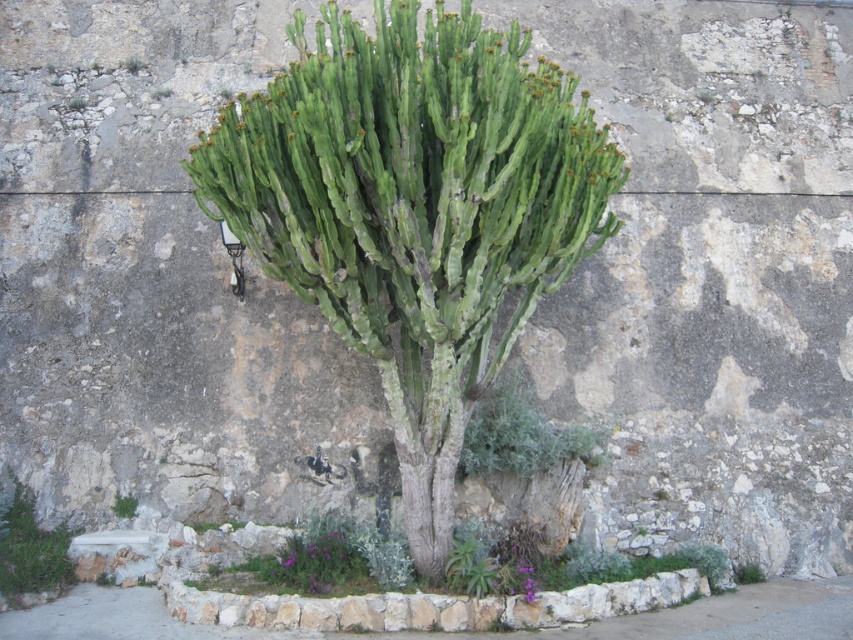
Which is in front, point (367, 252) or point (126, 502)?

Point (367, 252)

Does green woody at center have a lesser width compared to green succulent at lower left?

Yes.

Consider the image. Measure the distance between point (556,88) and camera.

Point (556,88) is 13.93 meters away from camera.

The height and width of the screenshot is (640, 853). In order to click on green woody at center in this screenshot , I will do `click(415, 209)`.

Describe the element at coordinates (28, 548) in the screenshot. I see `purple matte plant at lower left` at that location.

Does purple matte plant at lower left appear on the left side of green succulent at lower left?

Correct, you'll find purple matte plant at lower left to the left of green succulent at lower left.

Between point (18, 584) and point (120, 513), which one is positioned behind?

The point (120, 513) is more distant.

Find the location of a particular element. Image resolution: width=853 pixels, height=640 pixels. purple matte plant at lower left is located at coordinates (28, 548).

Does green woody at center have a smaller size compared to purple matte plant at lower left?

Indeed, green woody at center has a smaller size compared to purple matte plant at lower left.

Between green woody at center and purple matte plant at lower left, which one appears on the left side from the viewer's perspective?

purple matte plant at lower left is more to the left.

Locate an element on the screen. The height and width of the screenshot is (640, 853). green woody at center is located at coordinates pos(415,209).

Image resolution: width=853 pixels, height=640 pixels. Find the location of `green woody at center`. green woody at center is located at coordinates (415, 209).